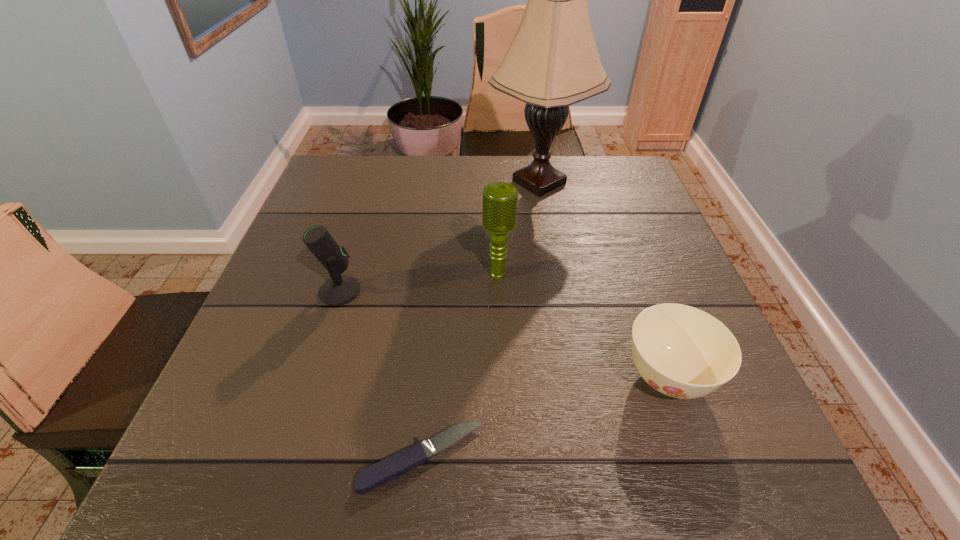
Find the location of a particular element. This screenshot has height=540, width=960. lamp is located at coordinates (553, 62).

Locate an element on the screen. The height and width of the screenshot is (540, 960). the farthest object is located at coordinates (553, 62).

You are a GUI agent. You are given a task and a screenshot of the screen. Output one action in this format:
    pyautogui.click(x=<x>, y=<y>)
    Task: Click on the taller microphone
    The height and width of the screenshot is (540, 960).
    Given the screenshot: What is the action you would take?
    pyautogui.click(x=500, y=199)

Where is `the right microphone`? the right microphone is located at coordinates (500, 199).

Where is `the left microphone`? The image size is (960, 540). the left microphone is located at coordinates (340, 289).

The width and height of the screenshot is (960, 540). Identify the location of the shorter microphone. (340, 289).

Image resolution: width=960 pixels, height=540 pixels. Find the location of `the second shortest object`. the second shortest object is located at coordinates click(682, 352).

Locate an element on the screen. the fourth farthest object is located at coordinates (682, 352).

At what (x,y) coordinates should I click in order to perform the action: click on the nearest object. Please return your answer as a coordinate pair (x, y). The image size is (960, 540). Looking at the image, I should click on (392, 467).

Identify the location of steak knife. (392, 467).